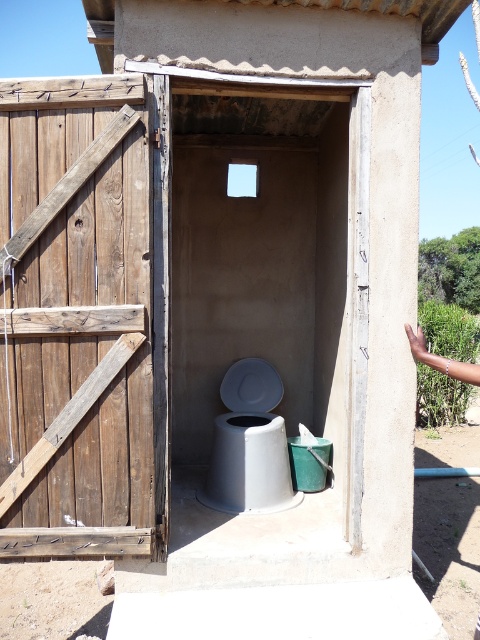
Question: Can you confirm if weathered wood door at left is bigger than white plastic toilet at center?

Choices:
 (A) yes
 (B) no

Answer: (B)

Question: Which of the following is the closest to the observer?

Choices:
 (A) weathered wood door at left
 (B) white plastic toilet at center

Answer: (A)

Question: Can you confirm if wooden door at left is positioned to the left of white plastic toilet at center?

Choices:
 (A) no
 (B) yes

Answer: (A)

Question: Considering the relative positions of weathered wood door at left and white plastic toilet at center in the image provided, where is weathered wood door at left located with respect to white plastic toilet at center?

Choices:
 (A) below
 (B) above

Answer: (B)

Question: Among these points, which one is nearest to the camera?

Choices:
 (A) (75, 321)
 (B) (279, 504)

Answer: (A)

Question: Which point is closer to the camera?

Choices:
 (A) white plastic toilet at center
 (B) wooden door at left

Answer: (A)